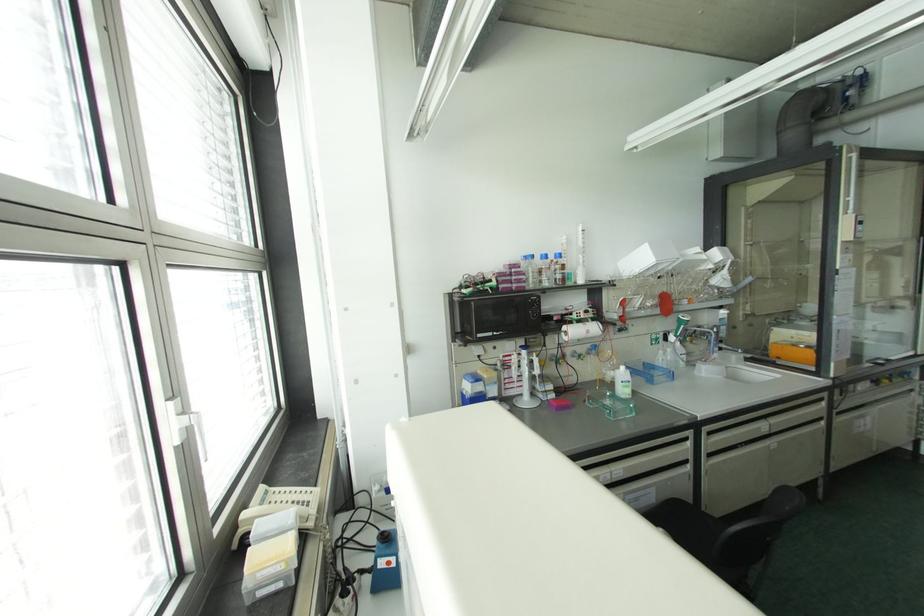
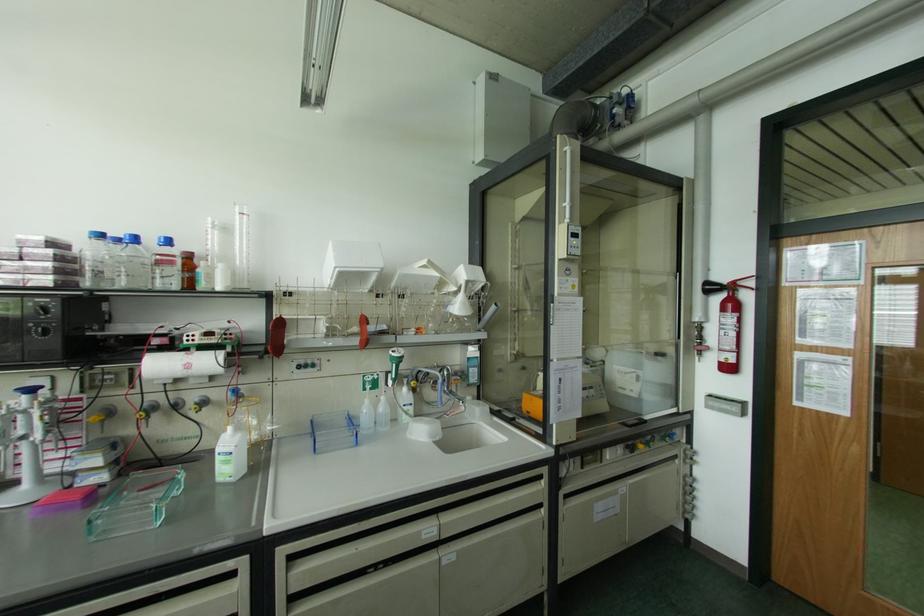
Where in the second image is the point corresponding to (579,232) from the first image?

(237, 216)